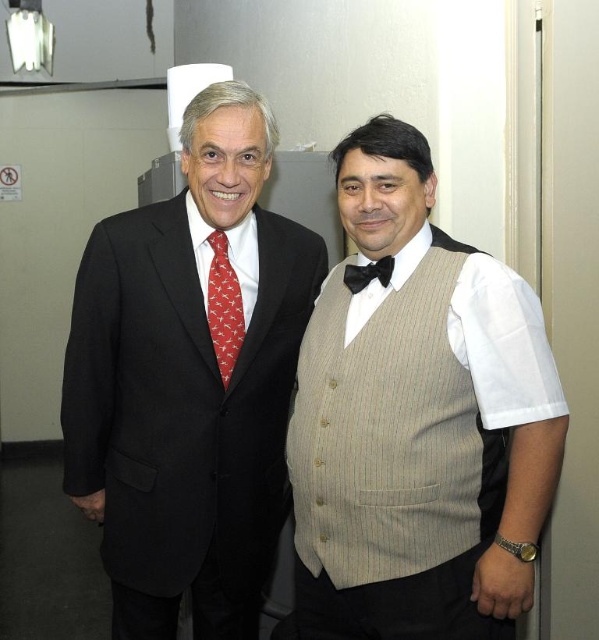
Consider the image. You are a tailor measuring two items for alterations. You have a beige striped vest at center and a black satin bow tie at center. Which item has a greater width?

The beige striped vest at center has a greater width than the black satin bow tie at center.

You are standing in a hallway and want to reach a point that is exactly at coordinate point (382,620). If your maximum reach is 4 feet, can you touch that point without moving closer?

The distance of point (382,620) from the camera is 4.62 feet, which is beyond your maximum reach of 4 feet. Therefore, you cannot touch that point without moving closer.